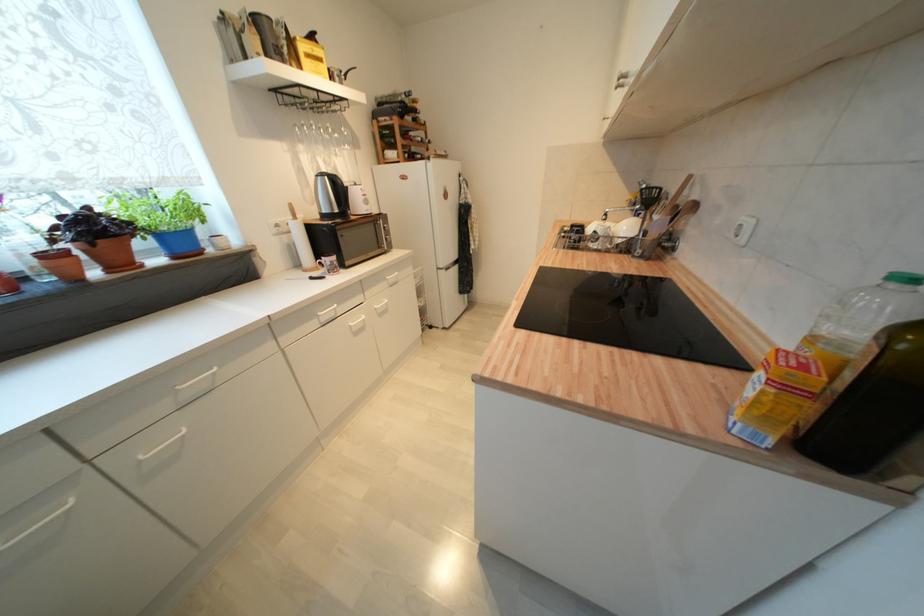
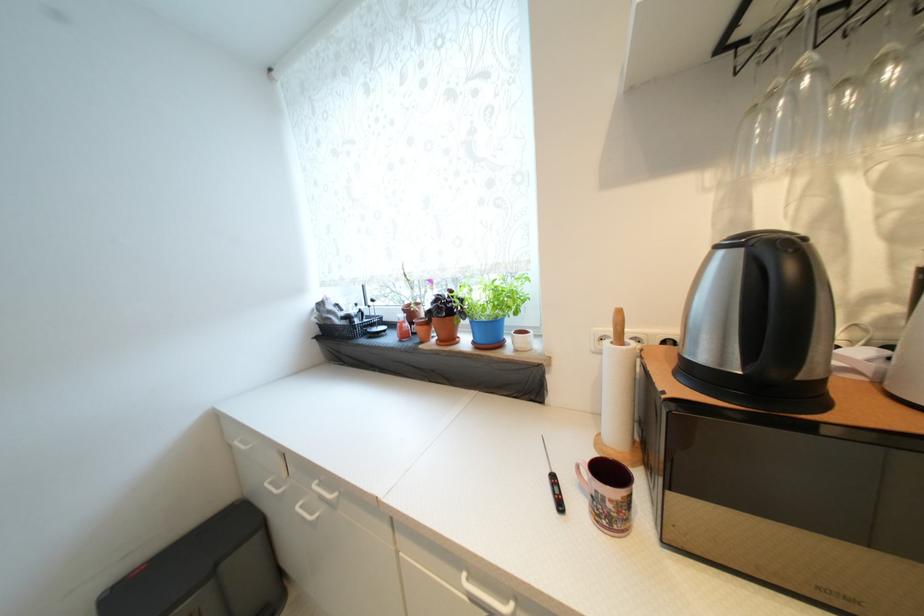
Find the pixel in the second image that matches [116,272] in the first image.

(445, 342)